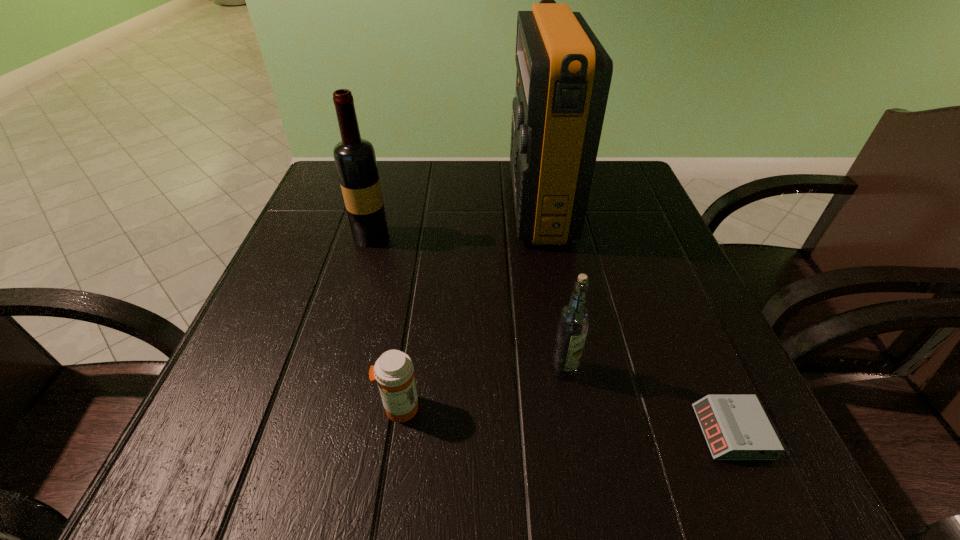
Find the location of `object present at the near right corner`. object present at the near right corner is located at coordinates (736, 427).

In the image, there is a desktop. Where is `free space at the far edge`? This screenshot has height=540, width=960. free space at the far edge is located at coordinates (462, 165).

In the image, there is a desktop. Where is `free space at the near edge`? This screenshot has height=540, width=960. free space at the near edge is located at coordinates (390, 455).

You are a GUI agent. You are given a task and a screenshot of the screen. Output one action in this format:
    pyautogui.click(x=<x>, y=<y>)
    Task: Click on the free space at the left edge of the desktop
    This screenshot has width=960, height=540.
    Given the screenshot: What is the action you would take?
    pyautogui.click(x=308, y=249)

At what (x,y) coordinates should I click in order to perform the action: click on vacant area at the right edge of the desktop. Please return your answer as a coordinate pair (x, y). The height and width of the screenshot is (540, 960). Looking at the image, I should click on (681, 363).

The image size is (960, 540). Find the location of `vacant space at the far right corner`. vacant space at the far right corner is located at coordinates (649, 208).

Where is `free space that is in between the alarm clock and the radio receiver`? The width and height of the screenshot is (960, 540). free space that is in between the alarm clock and the radio receiver is located at coordinates (636, 318).

Find the location of `free space between the second tallest object and the third nearest object`. free space between the second tallest object and the third nearest object is located at coordinates (468, 303).

Find the location of a particular element. The width and height of the screenshot is (960, 540). free space between the shortest object and the leftmost object is located at coordinates (551, 334).

Where is `vacant space that's between the wine bottle and the second object from left to right`? vacant space that's between the wine bottle and the second object from left to right is located at coordinates (386, 322).